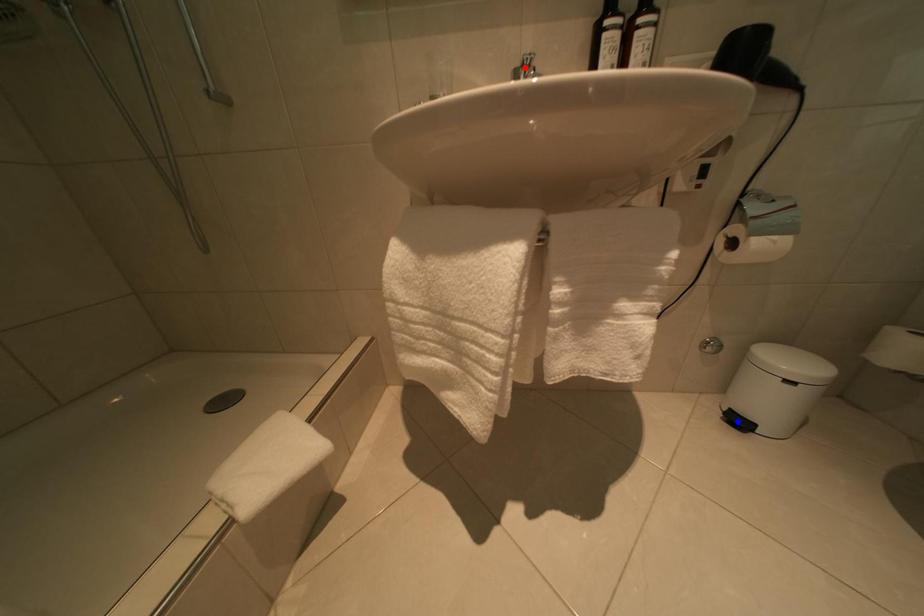
Question: Which of the two points in the image is closer to the camera?

Choices:
 (A) Blue point is closer.
 (B) Red point is closer.

Answer: (B)